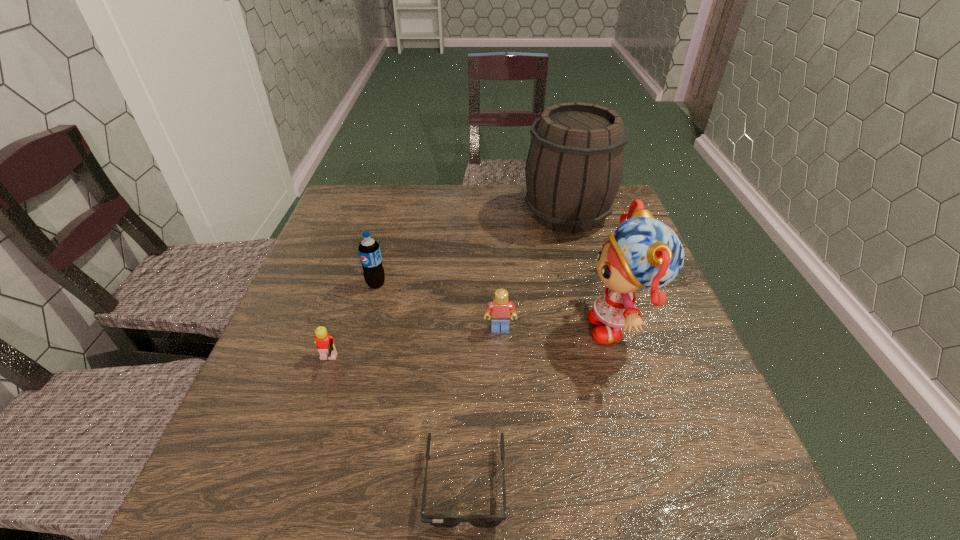
This screenshot has width=960, height=540. What are the coordinates of `wine bucket` in the screenshot? It's located at (574, 167).

The image size is (960, 540). What are the coordinates of `doll` in the screenshot? It's located at (644, 253).

Find the location of a particular element. This screenshot has height=540, width=960. soda bottle is located at coordinates (369, 251).

At what (x,y) coordinates should I click in order to perform the action: click on the fifth object from right to left. Please return your answer as a coordinate pair (x, y). This screenshot has width=960, height=540. Looking at the image, I should click on (369, 251).

At what (x,y) coordinates should I click in order to perform the action: click on the third shortest object. Please return your answer as a coordinate pair (x, y). The height and width of the screenshot is (540, 960). Looking at the image, I should click on (501, 309).

The image size is (960, 540). I want to click on the taller Lego, so click(x=501, y=309).

Locate an element on the screen. Image resolution: width=960 pixels, height=540 pixels. the shorter Lego is located at coordinates (324, 342).

Where is `the left Lego`? the left Lego is located at coordinates (324, 342).

Image resolution: width=960 pixels, height=540 pixels. Find the location of `the nearest object`. the nearest object is located at coordinates coord(440,521).

This screenshot has height=540, width=960. What are the coordinates of `sunglasses` in the screenshot? It's located at (440, 521).